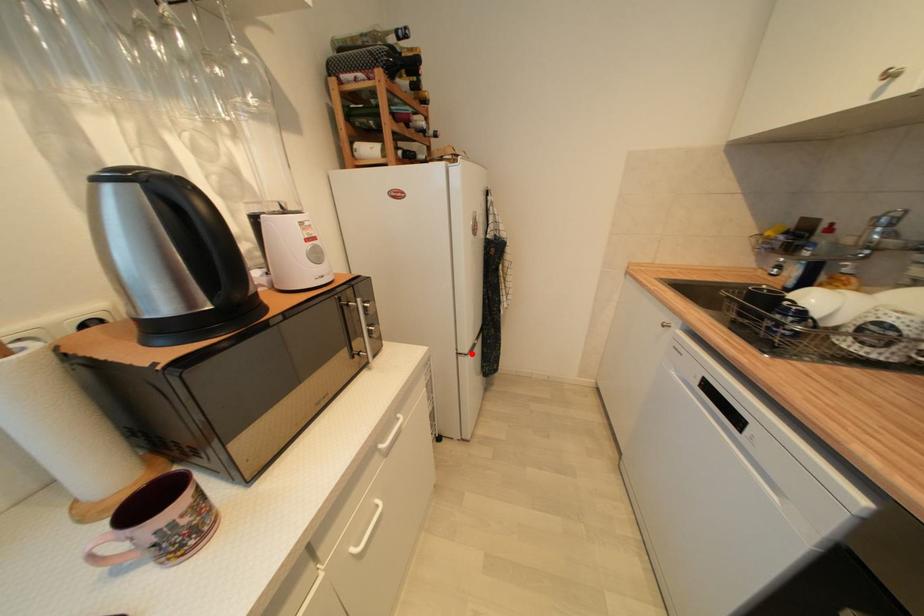
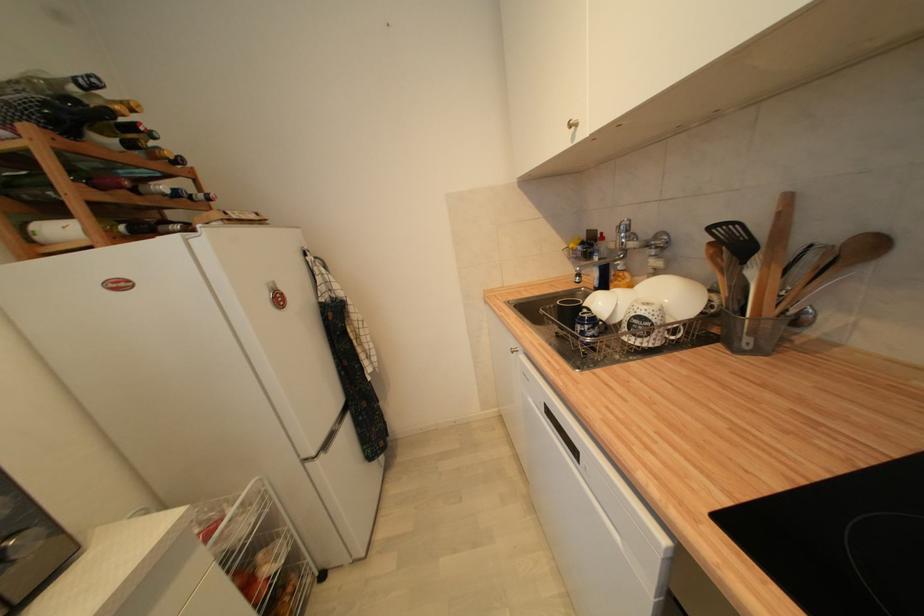
In the second image, find the point that corresponds to the highlighted location in the first image.

(319, 456)